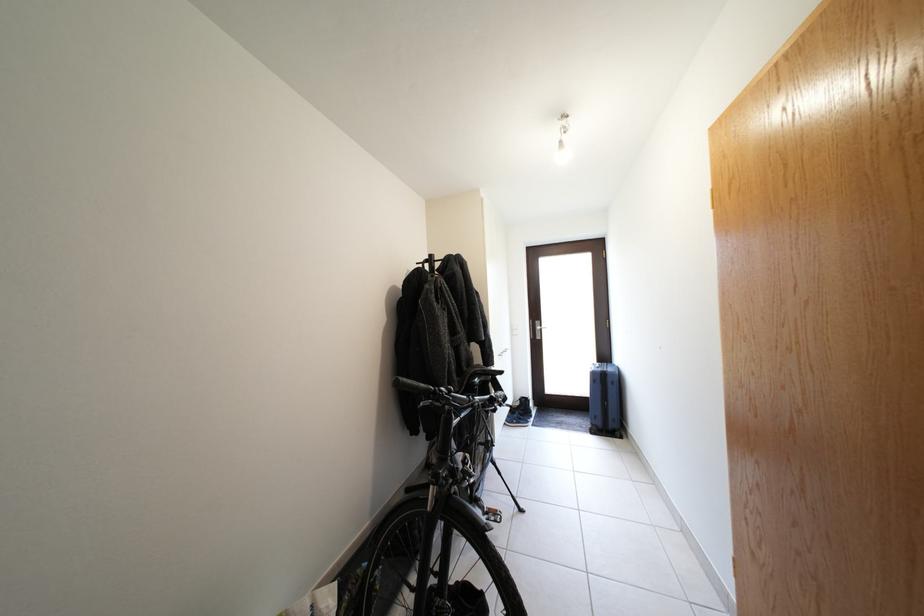
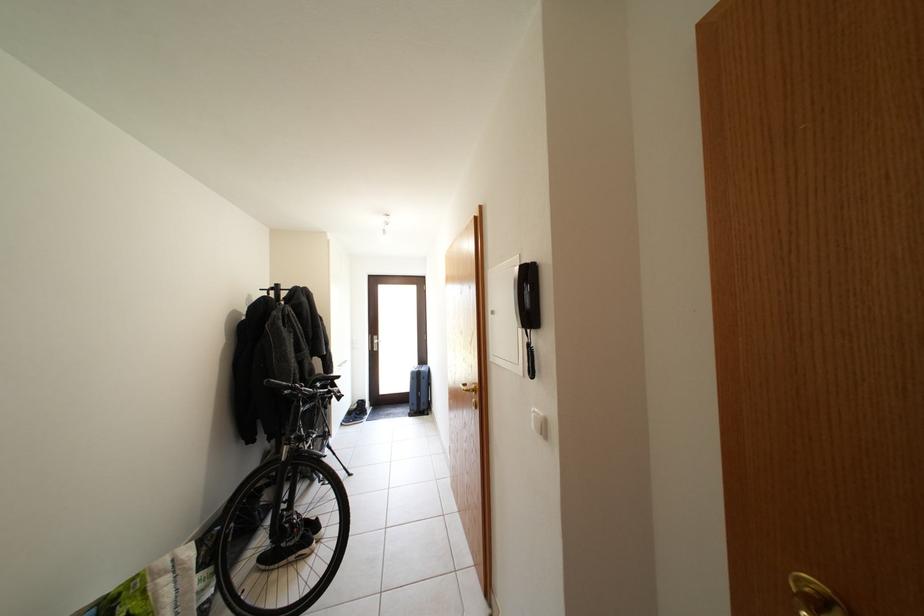
The point at [602,379] is marked in the first image. Where is the corresponding point in the second image?

(420, 379)